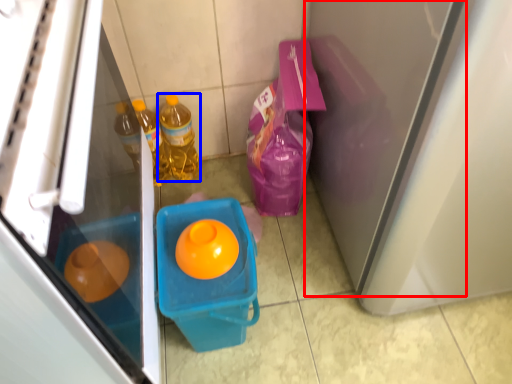
Question: Which point is closer to the camera, screen door (highlighted by a red box) or bottle (highlighted by a blue box)?

Choices:
 (A) screen door
 (B) bottle

Answer: (A)